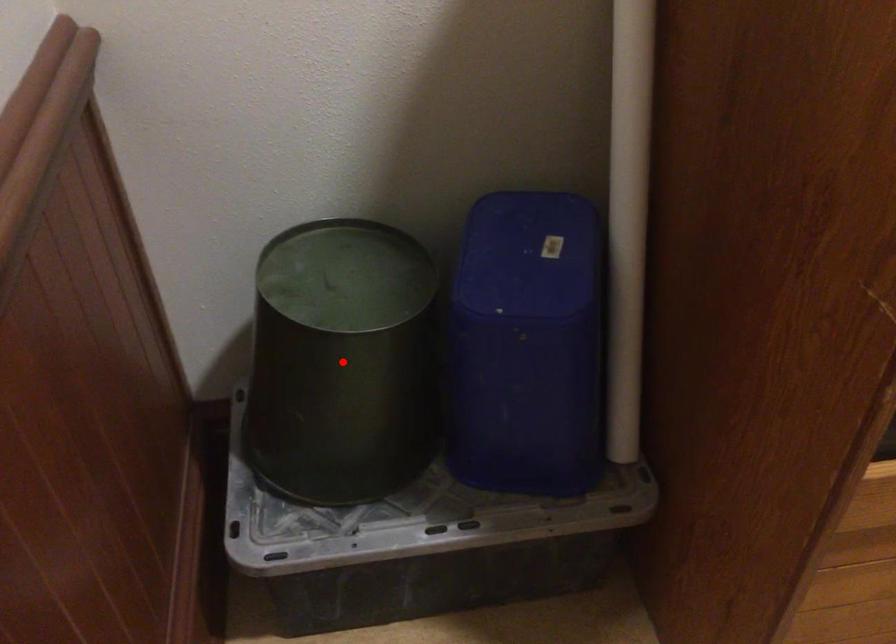
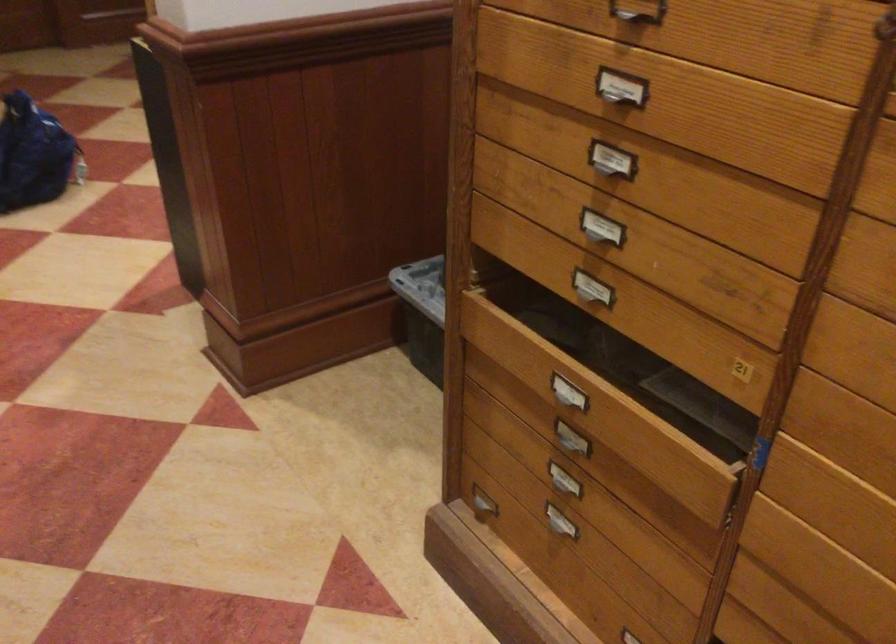
Question: I am providing you with two images of the same scene from different viewpoints. A red point is marked on the first image. Is the red point's position out of view in image 2?

Choices:
 (A) Yes
 (B) No

Answer: (A)